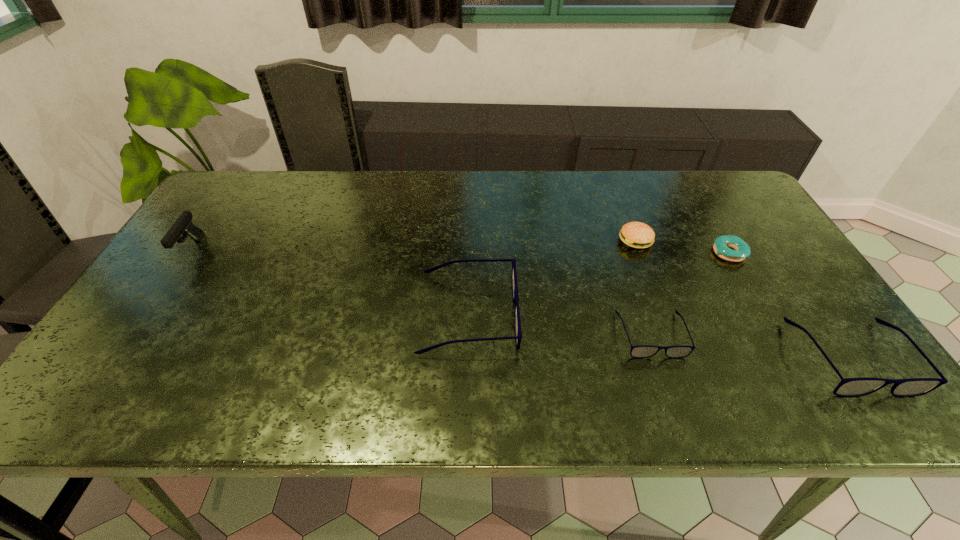
Where is `the fifth object from right to left`? This screenshot has width=960, height=540. the fifth object from right to left is located at coordinates (515, 294).

Where is `the second spectacles from right to left`? The height and width of the screenshot is (540, 960). the second spectacles from right to left is located at coordinates (641, 351).

What are the coordinates of `the rightmost spectacles` in the screenshot? It's located at (848, 387).

What are the coordinates of `the second tallest spectacles` in the screenshot? It's located at (848, 387).

At what (x,y) coordinates should I click in order to perform the action: click on doughnut. Please return your answer as a coordinate pair (x, y). Looking at the image, I should click on (722, 245).

You are a GUI agent. You are given a task and a screenshot of the screen. Output one action in this format:
    pyautogui.click(x=<x>, y=<y>)
    Task: Click on the pistol
    Image resolution: width=960 pixels, height=540 pixels.
    Given the screenshot: What is the action you would take?
    pyautogui.click(x=183, y=225)

The width and height of the screenshot is (960, 540). Identify the location of patty. (638, 235).

You are a GUI agent. You are given a task and a screenshot of the screen. Output one action in this format:
    pyautogui.click(x=<x>, y=<y>)
    Task: Click on the free spot located 0.100m on the front-facing side of the leftmost spectacles
    
    Given the screenshot: What is the action you would take?
    pyautogui.click(x=559, y=314)

You are a GUI agent. You are given a task and a screenshot of the screen. Output one action in this format:
    pyautogui.click(x=<x>, y=<y>)
    Task: Click on the vacant region located on the back of the shortest object
    The width and height of the screenshot is (960, 540).
    Given the screenshot: What is the action you would take?
    click(x=709, y=220)

What are the coordinates of `vacant area situated 0.060m on the front-facing side of the leftmost object` in the screenshot? It's located at (168, 284).